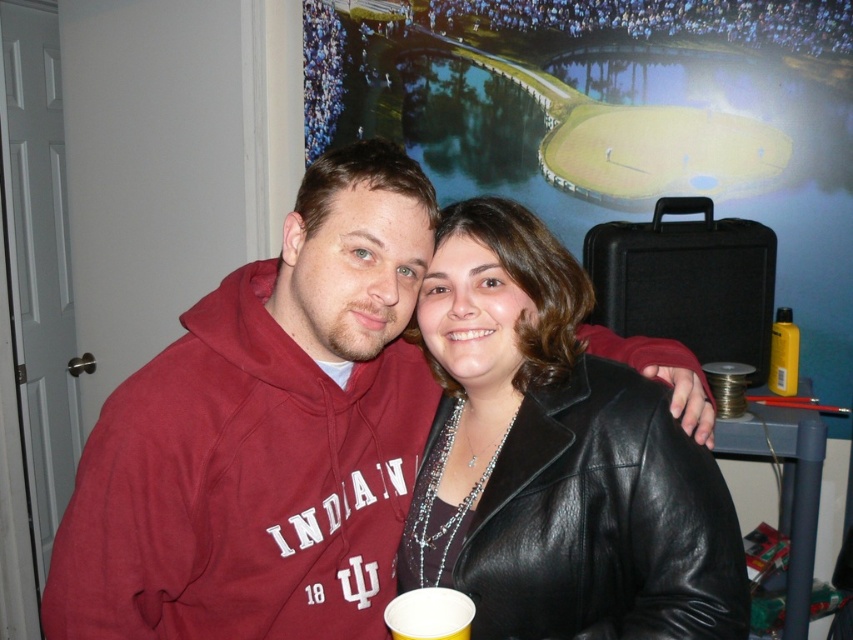
Is point (635, 456) behind point (445, 620)?

Yes, point (635, 456) is farther from viewer.

Between point (578, 573) and point (409, 637), which one is positioned in front?

Point (409, 637) is in front.

The height and width of the screenshot is (640, 853). In order to click on black leather jacket at center in this screenshot , I will do `click(556, 458)`.

Who is shorter, maroon hoodie at center or white paper cup at lower center?

With less height is white paper cup at lower center.

Can you confirm if maroon hoodie at center is taller than white paper cup at lower center?

Correct, maroon hoodie at center is much taller as white paper cup at lower center.

Identify the location of maroon hoodie at center. (265, 435).

Find the location of a particular element. The width and height of the screenshot is (853, 640). maroon hoodie at center is located at coordinates (265, 435).

Who is more distant from viewer, (291, 600) or (573, 625)?

Positioned behind is point (291, 600).

Between point (328, 390) and point (709, 468), which one is positioned behind?

Point (328, 390)

At what (x,y) coordinates should I click in order to perform the action: click on maroon hoodie at center. Please return your answer as a coordinate pair (x, y). The height and width of the screenshot is (640, 853). Looking at the image, I should click on (265, 435).